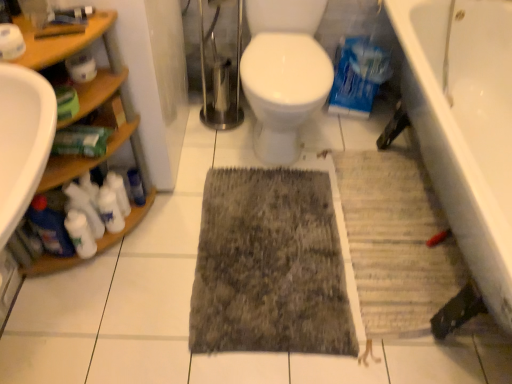
Identify the location of blank area beneath dark gray textured rug at center (from a real-world perspective). The image size is (512, 384). (270, 247).